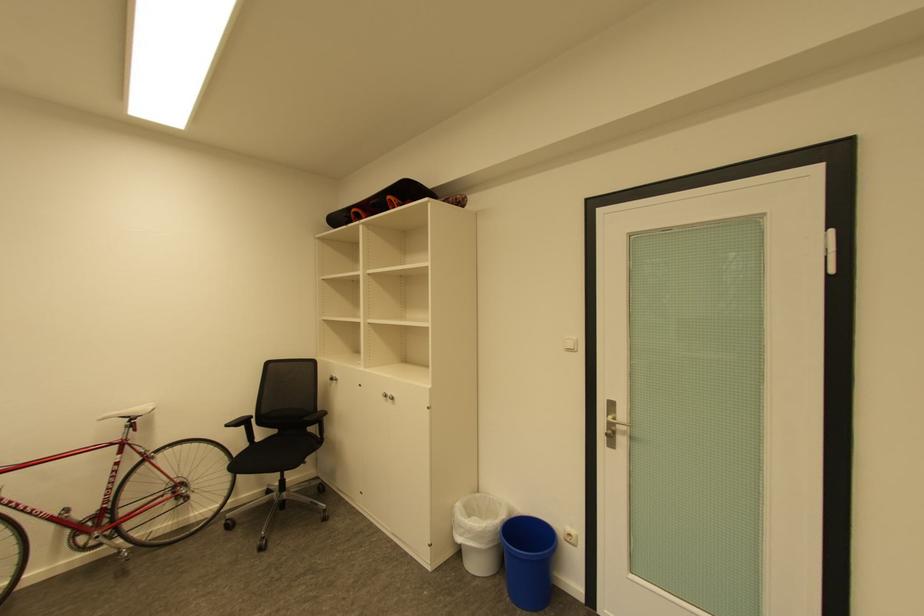
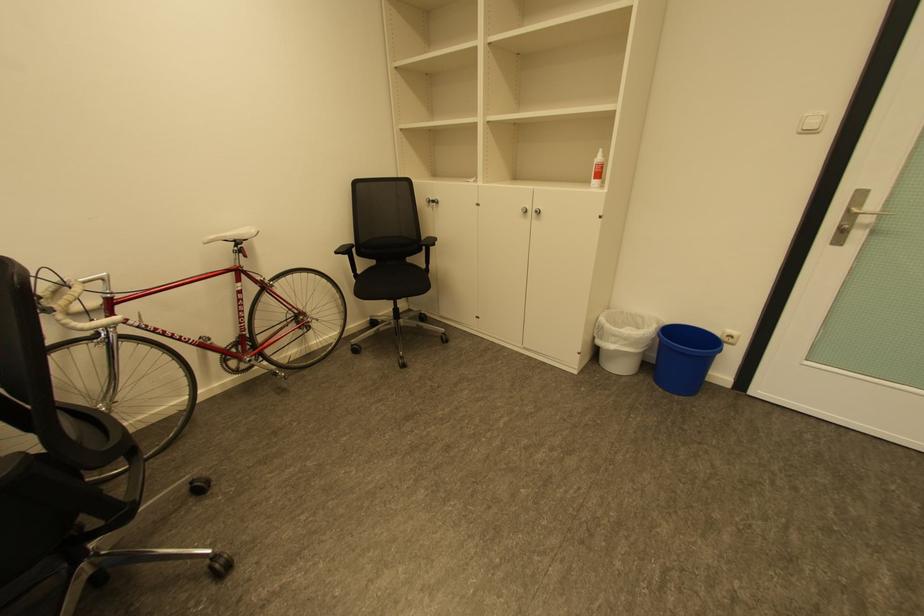
Where in the second image is the point corresponding to point 614,447 from the first image?

(837, 245)